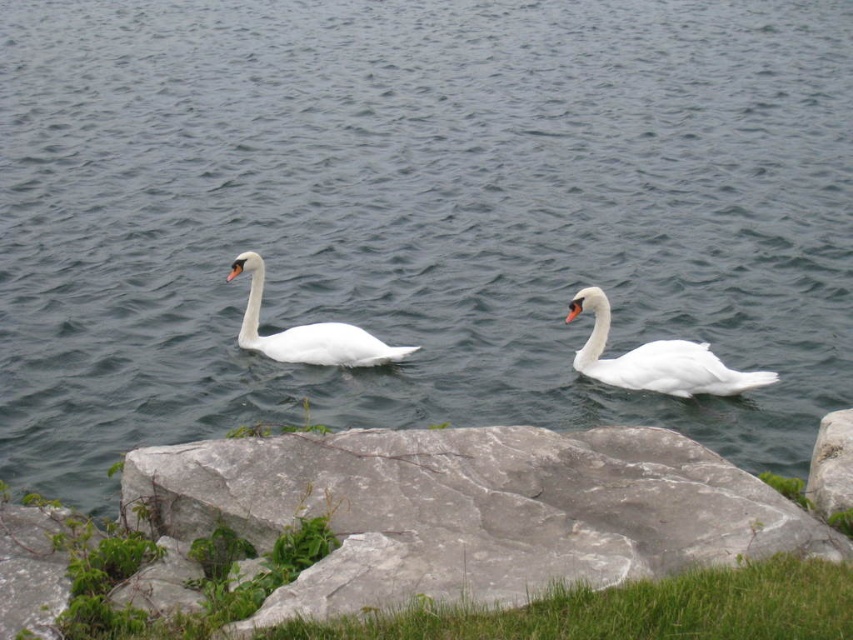
Question: Which object is the closest to the green grass at lower center?

Choices:
 (A) white glossy swan at right
 (B) gray rough rock at lower right

Answer: (B)

Question: Can you confirm if green grass at lower center is wider than white glossy swan at right?

Choices:
 (A) yes
 (B) no

Answer: (A)

Question: Does gray/rough rock at center appear on the left side of gray rough rock at lower right?

Choices:
 (A) no
 (B) yes

Answer: (B)

Question: Considering the relative positions of white glossy swan at right and gray rough rock at lower right in the image provided, where is white glossy swan at right located with respect to gray rough rock at lower right?

Choices:
 (A) right
 (B) left

Answer: (B)

Question: Among these points, which one is nearest to the camera?

Choices:
 (A) (807, 477)
 (B) (393, 454)
 (C) (656, 368)
 (D) (352, 616)

Answer: (D)

Question: Among these points, which one is nearest to the camera?

Choices:
 (A) (717, 358)
 (B) (810, 458)
 (C) (589, 593)
 (D) (735, 474)

Answer: (C)